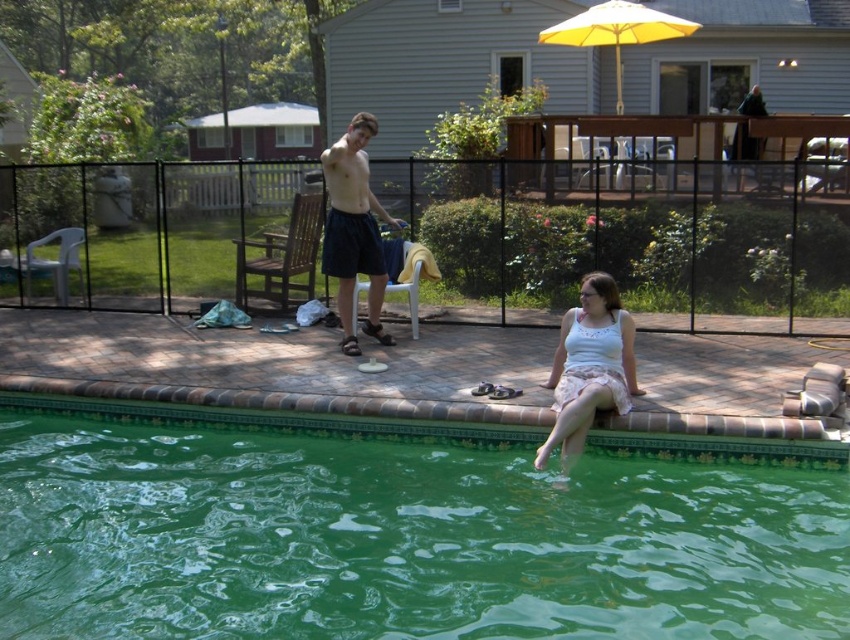
Question: Based on their relative distances, which object is nearer to the dark blue shorts at center?

Choices:
 (A) white lace dress at lower right
 (B) green glossy water at lower center

Answer: (A)

Question: Is green glossy water at lower center smaller than dark blue shorts at center?

Choices:
 (A) yes
 (B) no

Answer: (B)

Question: Which object is the farthest from the white lace dress at lower right?

Choices:
 (A) yellow fabric umbrella at upper right
 (B) dark blue shorts at center

Answer: (A)

Question: Does white lace dress at lower right have a lesser width compared to yellow fabric umbrella at upper right?

Choices:
 (A) yes
 (B) no

Answer: (A)

Question: Based on their relative distances, which object is farther from the yellow fabric umbrella at upper right?

Choices:
 (A) green glossy water at lower center
 (B) dark blue shorts at center
 (C) white lace dress at lower right

Answer: (A)

Question: Is the position of white lace dress at lower right more distant than that of yellow fabric umbrella at upper right?

Choices:
 (A) no
 (B) yes

Answer: (A)